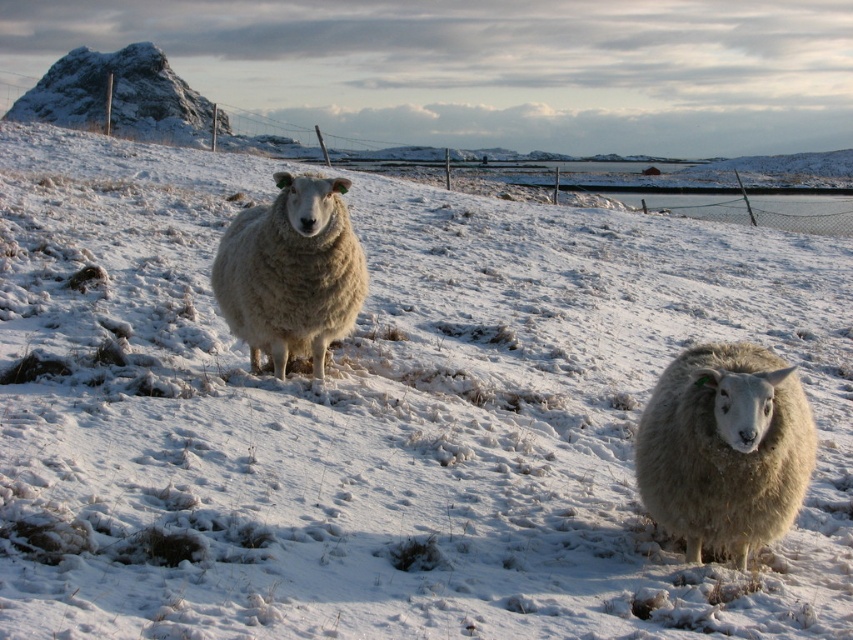
Does white woolly sheep at lower right appear under white woolly sheep at center?

Yes, white woolly sheep at lower right is below white woolly sheep at center.

Is white woolly sheep at lower right bigger than white woolly sheep at center?

No, white woolly sheep at lower right is not bigger than white woolly sheep at center.

Between point (747, 524) and point (215, 298), which one is positioned behind?

Point (215, 298)

The width and height of the screenshot is (853, 640). I want to click on white woolly sheep at lower right, so click(x=724, y=449).